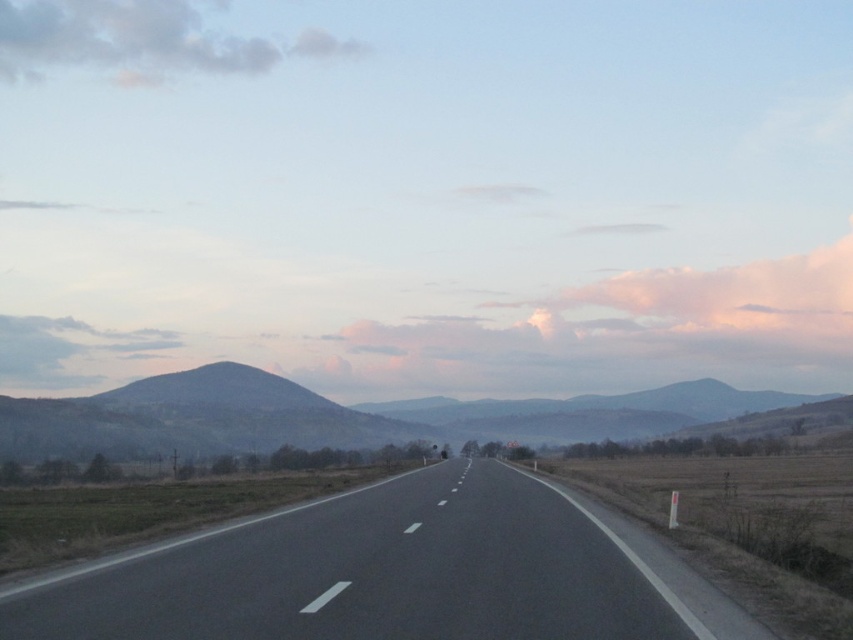
Question: Is the position of dark gray textured mountain at left less distant than that of cloudy sky at upper left?

Choices:
 (A) no
 (B) yes

Answer: (B)

Question: In this image, where is black asphalt highway at center located relative to dark gray textured mountain at left?

Choices:
 (A) below
 (B) above

Answer: (B)

Question: Which of the following is the farthest from the observer?

Choices:
 (A) dark gray textured mountain at left
 (B) black asphalt highway at center
 (C) cloudy sky at upper left

Answer: (C)

Question: Which is nearer to the black asphalt highway at center?

Choices:
 (A) dark gray textured mountain at left
 (B) cloudy sky at upper left

Answer: (A)

Question: Can you confirm if black asphalt highway at center is positioned to the right of cloudy sky at upper left?

Choices:
 (A) yes
 (B) no

Answer: (A)

Question: Which object is closer to the camera taking this photo?

Choices:
 (A) black asphalt highway at center
 (B) cloudy sky at upper left

Answer: (A)